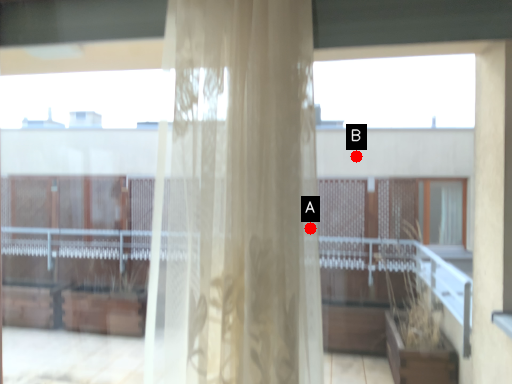
Question: Two points are circled on the image, labeled by A and B beside each circle. Among these points, which one is nearest to the camera?

Choices:
 (A) A is closer
 (B) B is closer

Answer: (A)